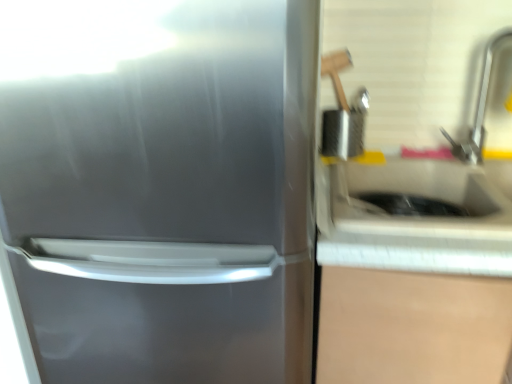
Question: Does point (471, 134) appear closer or farther from the camera than point (462, 205)?

Choices:
 (A) closer
 (B) farther

Answer: (B)

Question: From a real-world perspective, is satin nickel faucet at upper right above or below white glossy sink at right?

Choices:
 (A) above
 (B) below

Answer: (A)

Question: Considering the real-world distances, which object is closest to the satin silver refrigerator at left?

Choices:
 (A) satin nickel faucet at upper right
 (B) white glossy sink at right

Answer: (B)

Question: Estimate the real-world distances between objects in this image. Which object is farther from the satin nickel faucet at upper right?

Choices:
 (A) satin silver refrigerator at left
 (B) white glossy sink at right

Answer: (A)